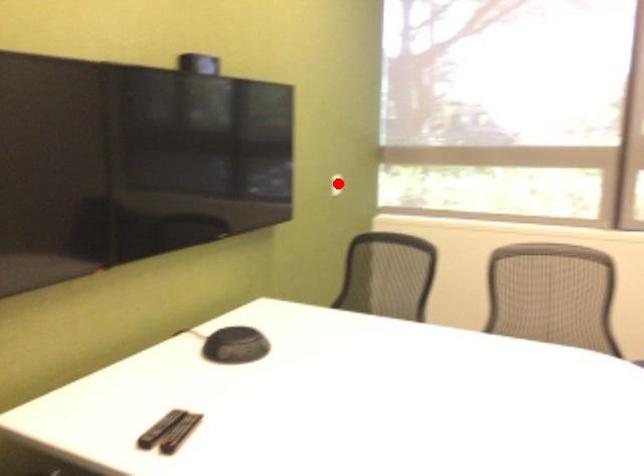
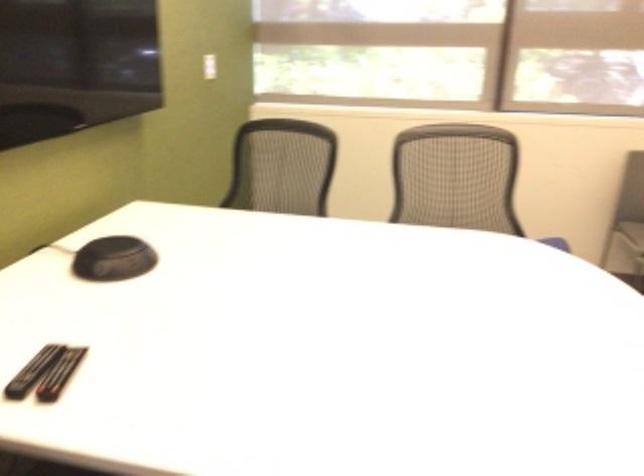
In the second image, find the point that corresponds to the highlighted location in the first image.

(209, 66)